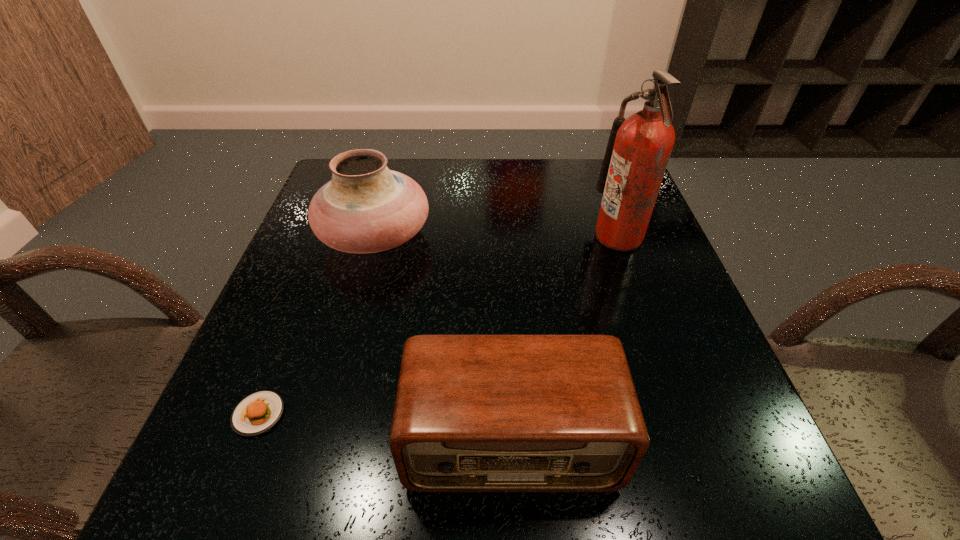
This screenshot has height=540, width=960. Identify the location of fire extinguisher. (638, 150).

Identify the location of the tallest object. This screenshot has height=540, width=960. (638, 150).

This screenshot has height=540, width=960. I want to click on the second tallest object, so coord(366,208).

Identify the location of radio receiver. (473, 413).

Find the location of `the second object from right to left`. the second object from right to left is located at coordinates (473, 413).

Locate an element on the screen. The height and width of the screenshot is (540, 960). the shortest object is located at coordinates (258, 412).

Locate an element on the screen. free region located 0.200m on the front of the tallest object near the operation label is located at coordinates (510, 236).

The image size is (960, 540). I want to click on free spot located 0.180m on the front of the tallest object near the operation label, so click(518, 236).

You are a GUI agent. You are given a task and a screenshot of the screen. Output one action in this format:
    pyautogui.click(x=<x>, y=<y>)
    Task: Click on the free space located 0.160m on the front of the tallest object near the operation label
    This screenshot has width=960, height=540.
    Given the screenshot: What is the action you would take?
    pyautogui.click(x=527, y=236)

Where is `vacant space located on the back of the pottery`? Image resolution: width=960 pixels, height=540 pixels. vacant space located on the back of the pottery is located at coordinates (391, 178).